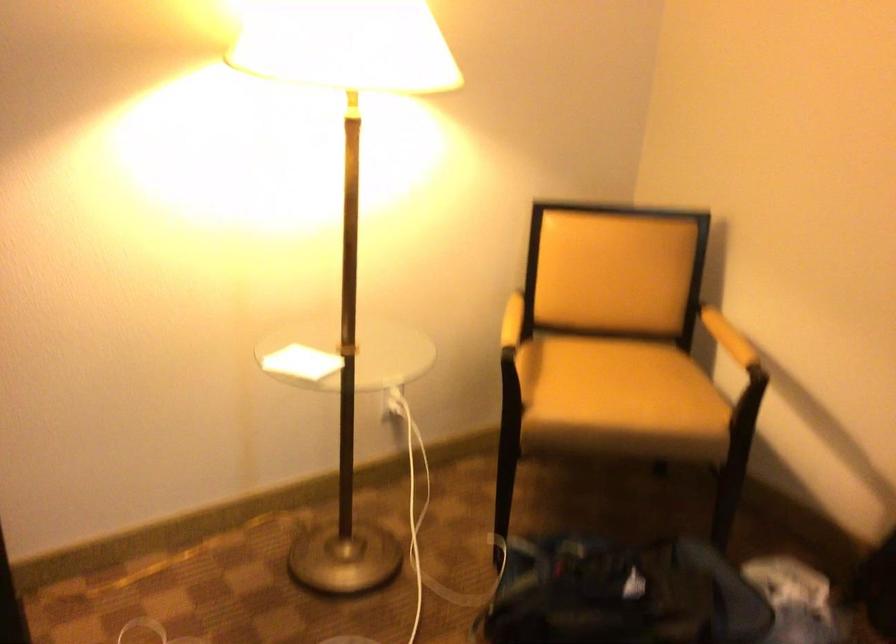
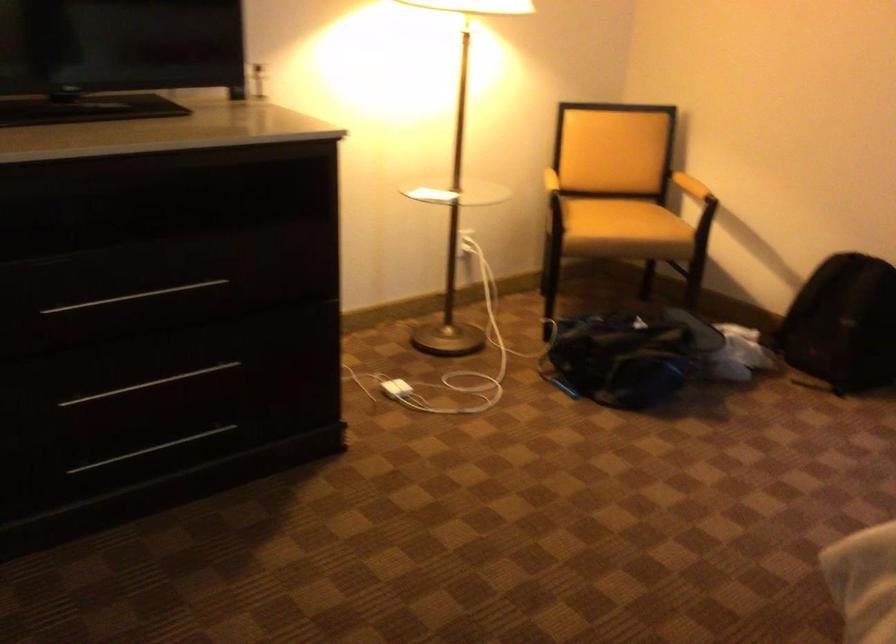
Where in the second image is the point corresponding to point 734,350 from the first image?

(690, 185)